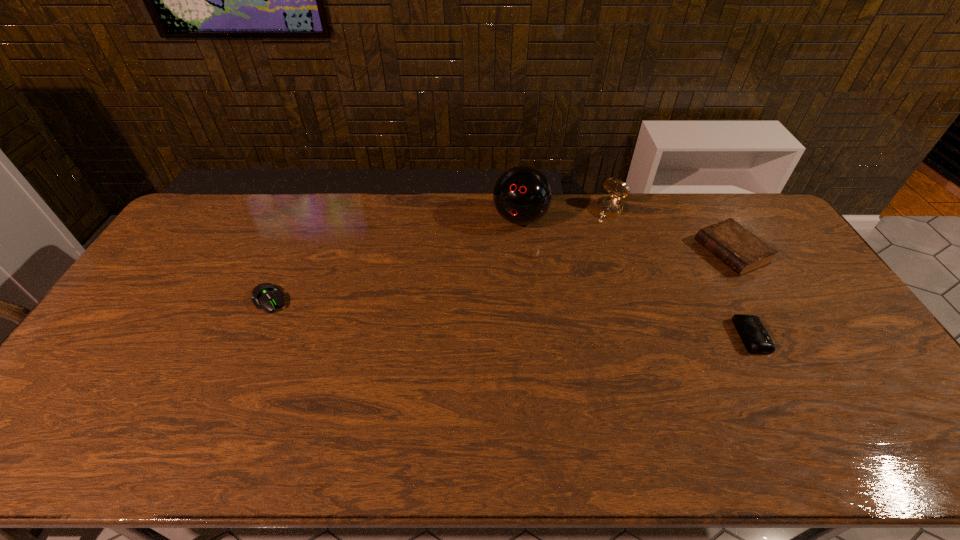
Identify the location of the leftmost object. The image size is (960, 540). (265, 295).

Where is `computer mouse`? This screenshot has width=960, height=540. computer mouse is located at coordinates coord(265,295).

Where is `alarm clock`? alarm clock is located at coordinates (755, 337).

This screenshot has width=960, height=540. I want to click on the tallest object, so click(522, 195).

I want to click on the second object from left to right, so click(x=522, y=195).

You are a GUI agent. You are given a task and a screenshot of the screen. Output one action in this format:
    pyautogui.click(x=<x>, y=<y>)
    Task: Click on the fourth shortest object
    
    Given the screenshot: What is the action you would take?
    pyautogui.click(x=608, y=206)

Find the location of a particular element. The width and height of the screenshot is (960, 540). the third object from right to left is located at coordinates (608, 206).

You are a GUI agent. You are given a task and a screenshot of the screen. Output one action in this format:
    pyautogui.click(x=<x>, y=<y>)
    Task: Click on the third tallest object
    
    Given the screenshot: What is the action you would take?
    pyautogui.click(x=742, y=251)

Find the location of a particular element. The height and width of the screenshot is (540, 960). free space located on the right of the fourth farthest object is located at coordinates (374, 300).

Locate an element on the screen. free space located on the display of the alarm clock is located at coordinates 852,336.